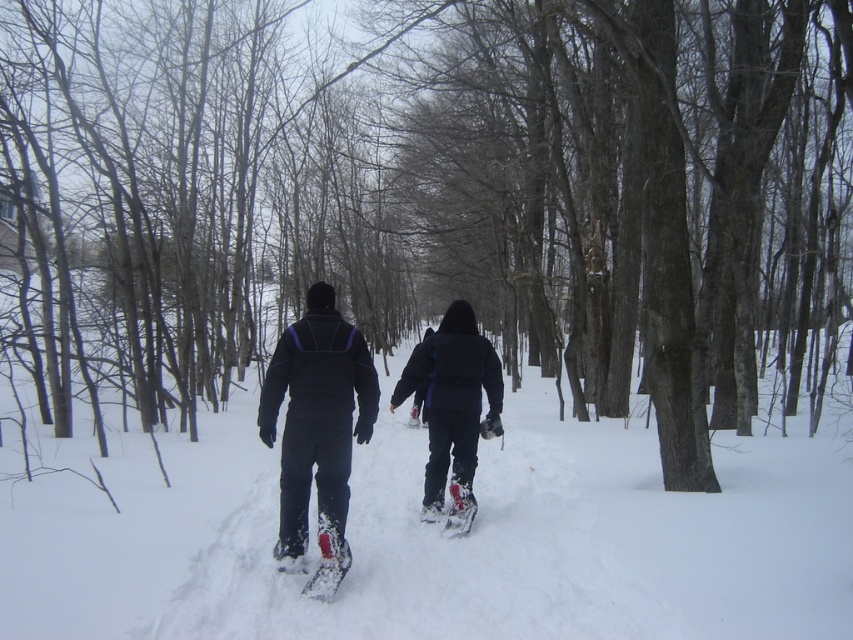
Is matte black snowsuit at center thinner than white rubber snowshoe at center?

No, matte black snowsuit at center is not thinner than white rubber snowshoe at center.

Which is in front, point (299, 541) or point (299, 556)?

Point (299, 541) is in front.

Which is in front, point (309, 474) or point (296, 561)?

Point (309, 474) is in front.

Identify the location of matte black snowsuit at center. (318, 420).

Is black matte snowshoes at center below white plastic snowshoe at center?

Incorrect, black matte snowshoes at center is not positioned below white plastic snowshoe at center.

Does point (363, 381) come closer to viewer compared to point (328, 561)?

That is False.

At what (x,y) coordinates should I click in order to perform the action: click on black matte snowshoes at center. Please return your answer as a coordinate pair (x, y). This screenshot has width=853, height=640. Looking at the image, I should click on (318, 428).

Can you confirm if white fluffy snow at center is positioned to the right of white rubber snowshoe at center?

Yes, white fluffy snow at center is to the right of white rubber snowshoe at center.

Is point (782, 524) farther from camera compared to point (305, 561)?

No, it is not.

This screenshot has height=640, width=853. What are the coordinates of `white fluffy snow at center` in the screenshot? It's located at point(440,538).